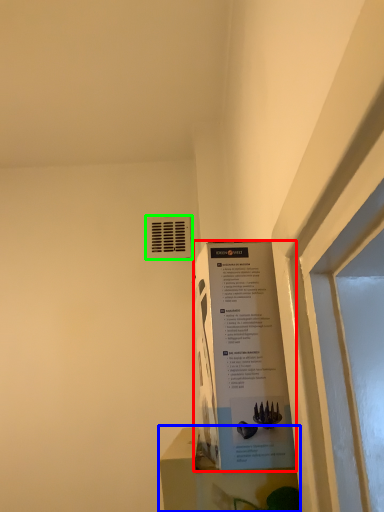
Question: Which object is positioned farthest from poster (highlighted by a red box)? Select from window sill (highlighted by a blue box) and air conditioning (highlighted by a green box).

Choices:
 (A) window sill
 (B) air conditioning

Answer: (B)